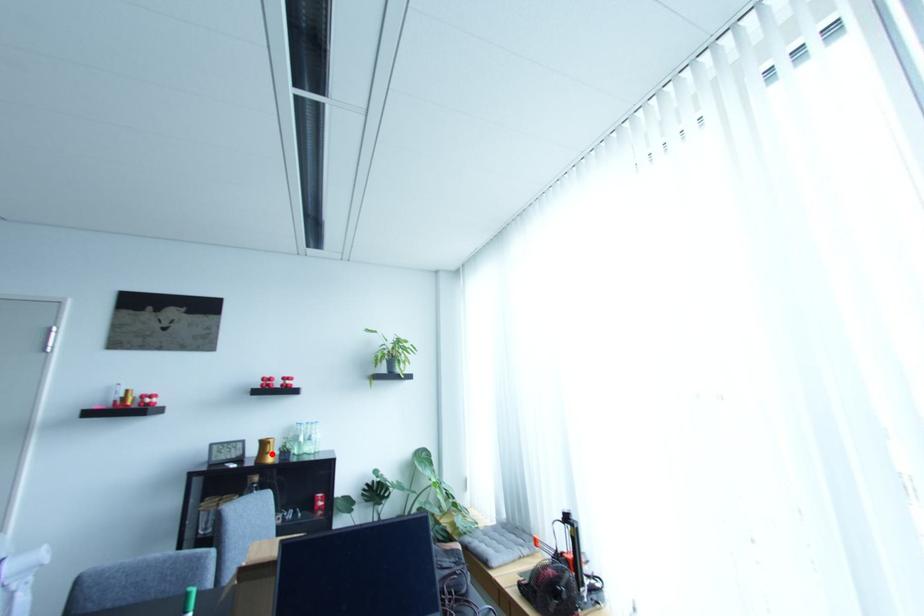
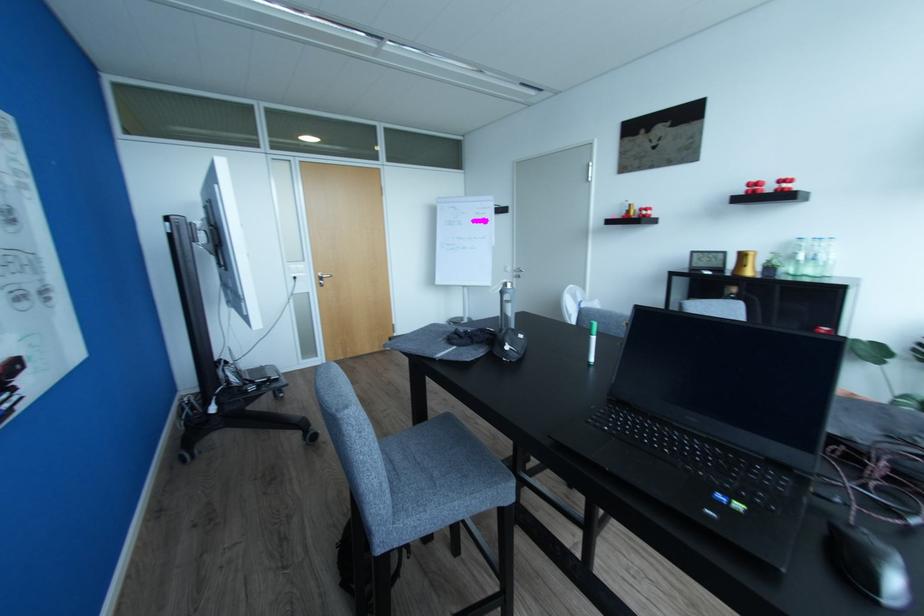
Locate, in the second image, the point that corresponds to the highlighted location in the first image.

(750, 267)